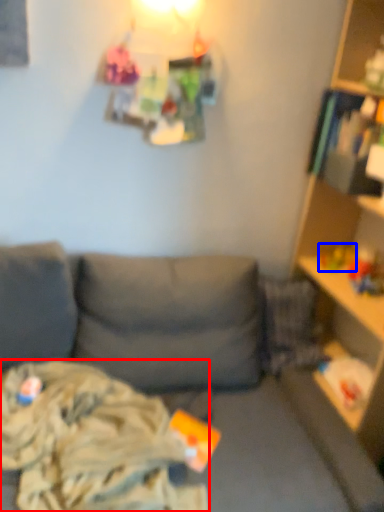
Question: Which point is closer to the camera, clothing (highlighted by a red box) or toy (highlighted by a blue box)?

Choices:
 (A) clothing
 (B) toy

Answer: (A)